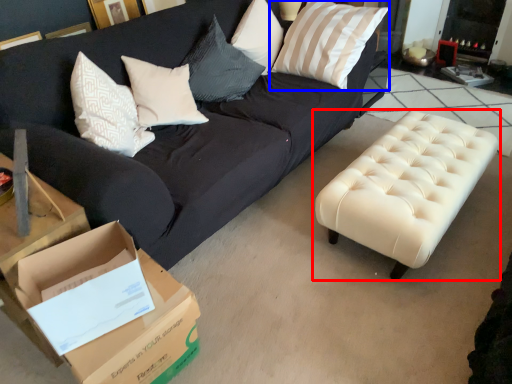
Question: Among these objects, which one is nearest to the camera, table (highlighted by a red box) or pillow (highlighted by a blue box)?

Choices:
 (A) table
 (B) pillow

Answer: (A)